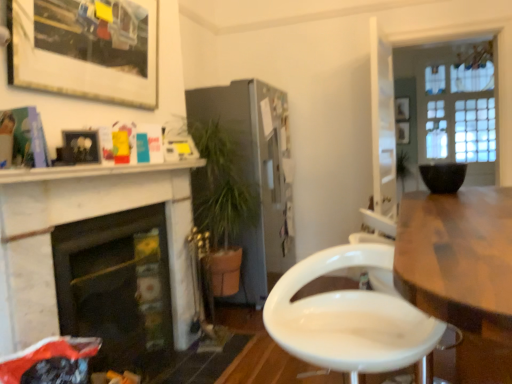
Question: Is wooden picture frame at upper right, which is the 1th picture frame from right to left, taller than white marble fireplace at left, which ranks as the 1th fireplace in front-to-back order?

Choices:
 (A) no
 (B) yes

Answer: (A)

Question: Considering the relative sizes of wooden picture frame at upper right, marked as the second picture frame in a top-to-bottom arrangement, and white marble fireplace at left, which ranks as the 1th fireplace in front-to-back order, in the image provided, is wooden picture frame at upper right, marked as the second picture frame in a top-to-bottom arrangement, smaller than white marble fireplace at left, which ranks as the 1th fireplace in front-to-back order,?

Choices:
 (A) no
 (B) yes

Answer: (B)

Question: Can you confirm if wooden picture frame at upper right, the 4th picture frame in the front-to-back sequence, is wider than white marble fireplace at left, which ranks as the 1th fireplace in front-to-back order?

Choices:
 (A) yes
 (B) no

Answer: (B)

Question: Is white marble fireplace at left, which is the second fireplace from back to front, a part of wooden picture frame at upper right, the 4th picture frame in the front-to-back sequence?

Choices:
 (A) no
 (B) yes

Answer: (A)

Question: Is wooden picture frame at upper right, which is the 1th picture frame from right to left, in front of white marble fireplace at left, which is the second fireplace from back to front?

Choices:
 (A) yes
 (B) no

Answer: (B)

Question: Is white marble shelf at upper left inside the boundaries of matte white picture frame at upper left, acting as the 3th picture frame starting from the top, or outside?

Choices:
 (A) inside
 (B) outside

Answer: (B)

Question: From a real-world perspective, relative to matte white picture frame at upper left, acting as the 3th picture frame starting from the top, is white marble shelf at upper left vertically above or below?

Choices:
 (A) above
 (B) below

Answer: (B)

Question: Relative to matte white picture frame at upper left, which is the 4th picture frame in right-to-left order, is white marble shelf at upper left in front or behind?

Choices:
 (A) behind
 (B) front

Answer: (B)

Question: Looking at their shapes, would you say white marble shelf at upper left is wider or thinner than matte white picture frame at upper left, the first picture frame positioned from the left?

Choices:
 (A) wide
 (B) thin

Answer: (A)

Question: Is white glossy chair at center spatially inside white marble fireplace at left, which is the second fireplace from back to front, or outside of it?

Choices:
 (A) outside
 (B) inside

Answer: (A)

Question: Is white glossy chair at center in front of or behind white marble fireplace at left, which is the second fireplace from back to front, in the image?

Choices:
 (A) front
 (B) behind

Answer: (A)

Question: Based on their sizes in the image, would you say white glossy chair at center is bigger or smaller than white marble fireplace at left, which is the second fireplace from back to front?

Choices:
 (A) big
 (B) small

Answer: (B)

Question: From their relative heights in the image, would you say white glossy chair at center is taller or shorter than white marble fireplace at left, which is the second fireplace from back to front?

Choices:
 (A) tall
 (B) short

Answer: (B)

Question: Is white marble fireplace at left, which ranks as the 1th fireplace in front-to-back order, spatially inside matte white picture frame at upper left, the first picture frame positioned from the left, or outside of it?

Choices:
 (A) outside
 (B) inside

Answer: (A)

Question: Considering their positions, is white marble fireplace at left, which is the second fireplace from back to front, located in front of or behind matte white picture frame at upper left, which is the 4th picture frame in right-to-left order?

Choices:
 (A) front
 (B) behind

Answer: (A)